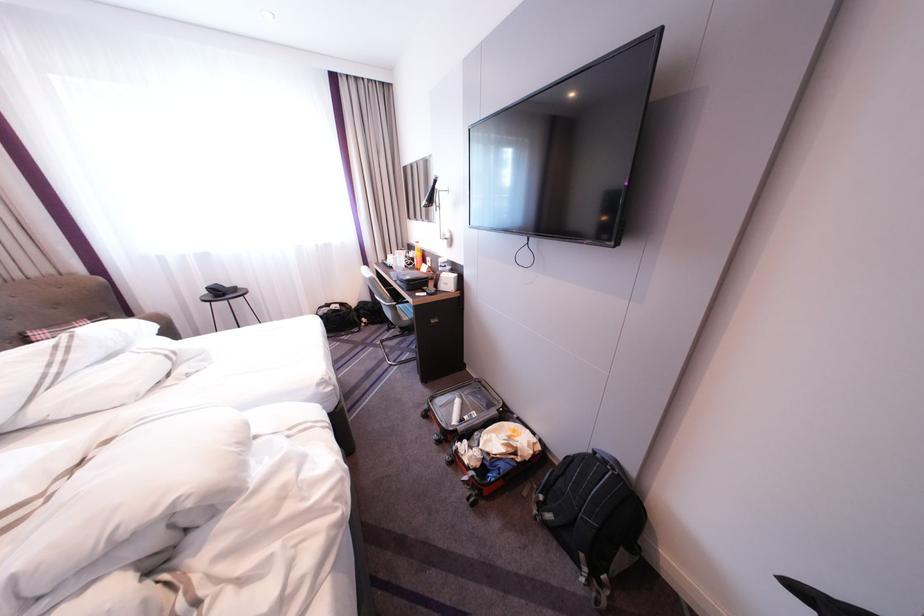
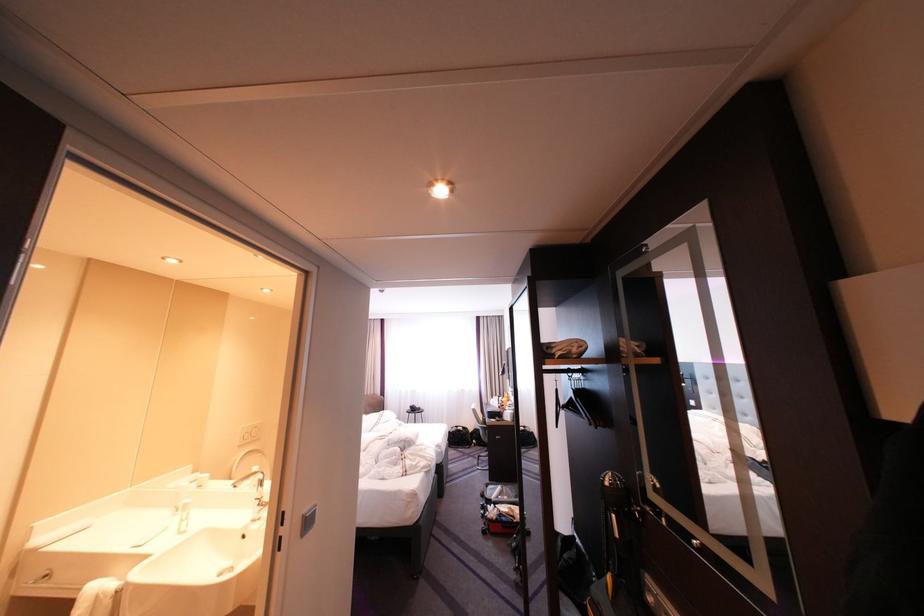
Locate, in the second image, the point that corresponds to (396,301) in the first image.

(491, 424)